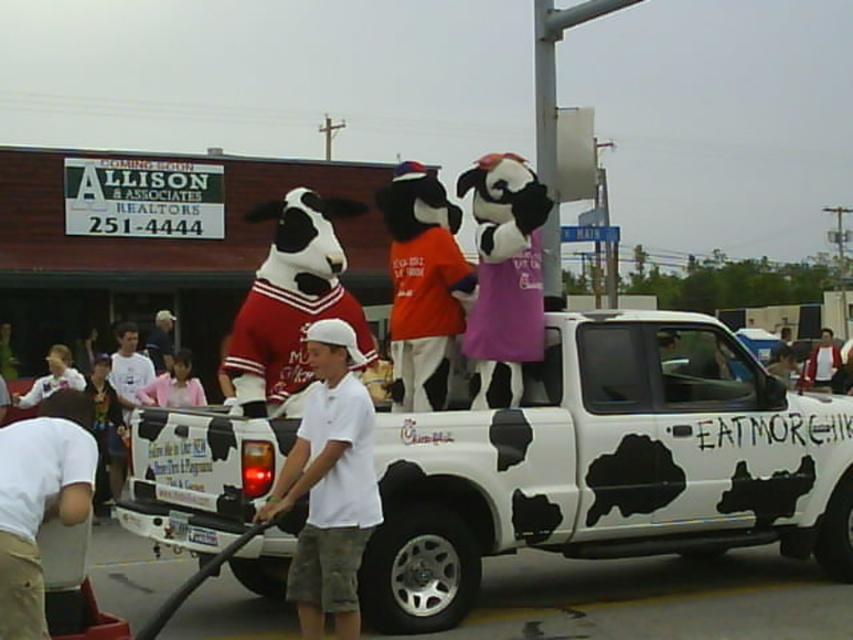
Question: Can you confirm if cow-printed truck at center is smaller than white cotton shirt at lower left?

Choices:
 (A) no
 (B) yes

Answer: (A)

Question: Is cow-printed truck at center further to the viewer compared to white cotton shirt at lower left?

Choices:
 (A) no
 (B) yes

Answer: (B)

Question: Which of the following is the closest to the observer?

Choices:
 (A) white cotton shirt at lower left
 (B) cow-printed truck at center

Answer: (A)

Question: Does cow-printed truck at center appear over white cotton shirt at lower left?

Choices:
 (A) no
 (B) yes

Answer: (A)